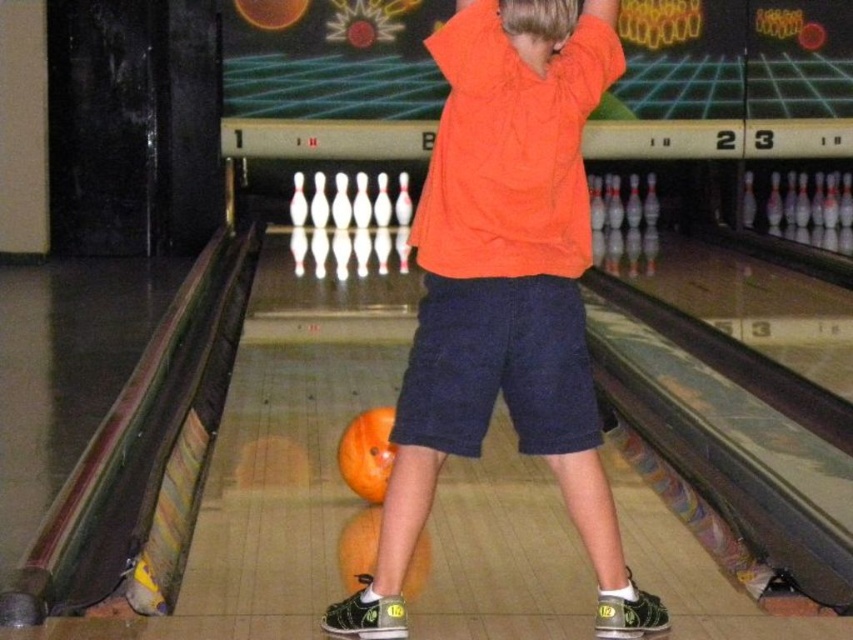
Image resolution: width=853 pixels, height=640 pixels. Describe the element at coordinates (367, 452) in the screenshot. I see `orange matte bowling ball at center` at that location.

Is point (357, 429) positioned before point (416, 544)?

No.

Which is behind, point (376, 480) or point (354, 586)?

The point (376, 480) is more distant.

Where is `orange matte bowling ball at center`? orange matte bowling ball at center is located at coordinates (367, 452).

Does orange cotton shirt at center have a larger size compared to orange matte bowling ball at center?

Indeed, orange cotton shirt at center has a larger size compared to orange matte bowling ball at center.

Which of these two, orange cotton shirt at center or orange matte bowling ball at center, stands shorter?

orange matte bowling ball at center

What do you see at coordinates (505, 289) in the screenshot? I see `orange cotton shirt at center` at bounding box center [505, 289].

Find the location of a particular element. Image resolution: width=853 pixels, height=640 pixels. orange cotton shirt at center is located at coordinates (505, 289).

Can you confirm if orange cotton shirt at center is taller than orange matte bowling ball at lower center?

Yes.

Looking at this image, can you confirm if orange cotton shirt at center is shorter than orange matte bowling ball at lower center?

No, orange cotton shirt at center is not shorter than orange matte bowling ball at lower center.

What do you see at coordinates (505, 289) in the screenshot? This screenshot has width=853, height=640. I see `orange cotton shirt at center` at bounding box center [505, 289].

Find the location of a particular element. orange cotton shirt at center is located at coordinates (505, 289).